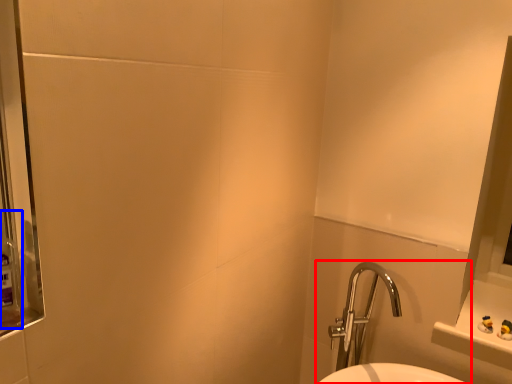
Question: Which point is closer to the camera, sink (highlighted by a red box) or mouthwash (highlighted by a blue box)?

Choices:
 (A) sink
 (B) mouthwash

Answer: (B)